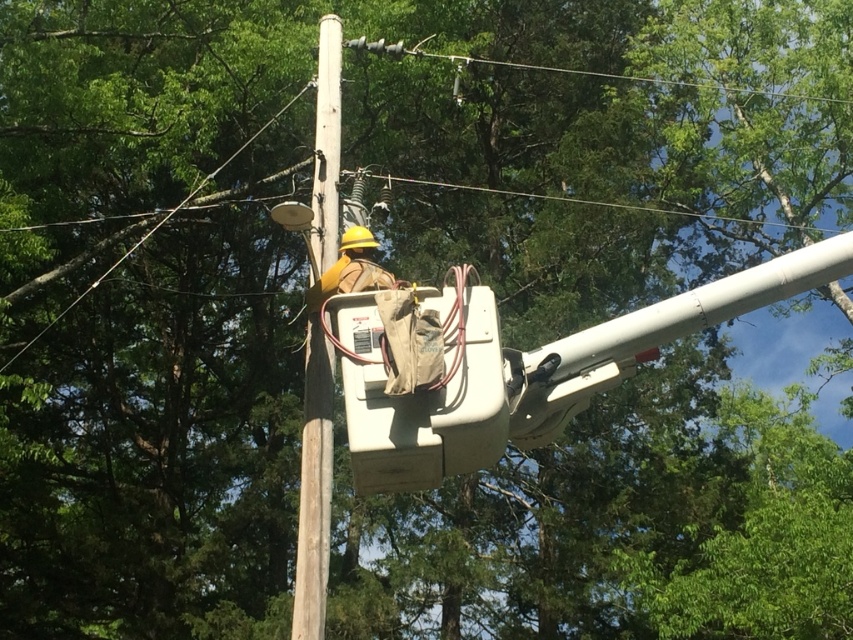
You are a safety inspector reviewing the scene. The brown wooden telegraph pole at center and yellow hard hat at upper center are visible. Which object is positioned higher in the image?

The yellow hard hat at upper center is positioned higher than the brown wooden telegraph pole at center, as it is located above it in the scene.

You are a safety inspector checking the utility worker setup. Based on the image, which object is thinner between the brown wooden telegraph pole at center and the yellow hard hat at upper center?

The brown wooden telegraph pole at center is thinner than the yellow hard hat at upper center according to the description.

You are a safety inspector checking the utility worker setup. Based on the scene, which object is bigger in size between the brown wooden telegraph pole at center and the yellow hard hat at upper center?

The brown wooden telegraph pole at center is larger in size than the yellow hard hat at upper center.